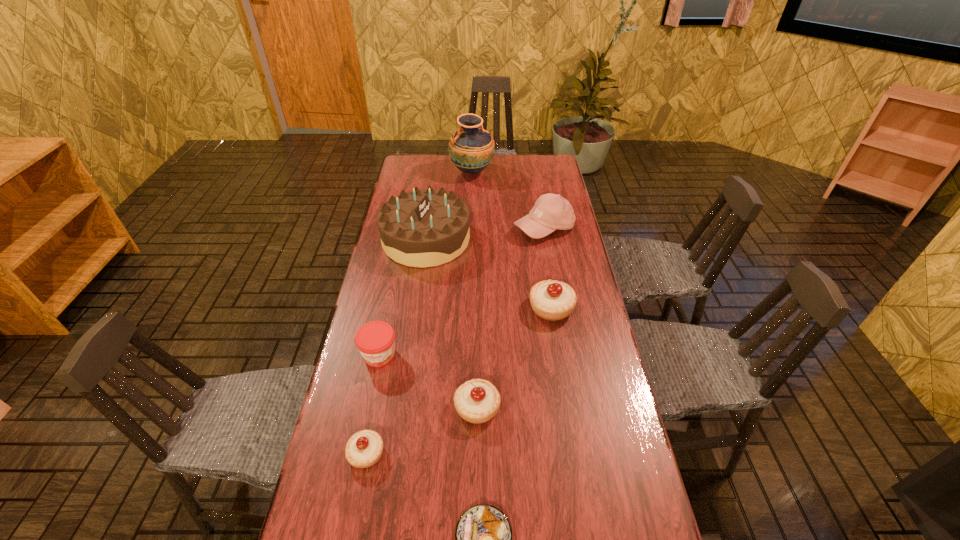
At what (x,y) coordinates should I click in order to perform the action: click on the tallest object. Please return your answer as a coordinate pair (x, y). Looking at the image, I should click on (471, 148).

Where is `the farthest object`? The height and width of the screenshot is (540, 960). the farthest object is located at coordinates (471, 148).

The height and width of the screenshot is (540, 960). In order to click on birthday cake in this screenshot , I will do `click(422, 228)`.

This screenshot has height=540, width=960. What are the coordinates of `brown birthday cake` in the screenshot? It's located at (422, 228).

Locate an element on the screen. baseball cap is located at coordinates (551, 211).

Image resolution: width=960 pixels, height=540 pixels. I want to click on the third tallest object, so click(551, 211).

You are a GUI agent. You are given a task and a screenshot of the screen. Output one action in this format:
    pyautogui.click(x=<x>, y=<y>)
    Task: Click on the rightmost pastry
    
    Given the screenshot: What is the action you would take?
    pyautogui.click(x=552, y=300)

You are a GUI agent. You are given a task and a screenshot of the screen. Output one action in this format:
    pyautogui.click(x=<x>, y=<y>)
    Task: Click on the tallest pastry
    
    Given the screenshot: What is the action you would take?
    pyautogui.click(x=552, y=300)

Locate an element on the screen. The height and width of the screenshot is (540, 960). jam is located at coordinates (375, 340).

The width and height of the screenshot is (960, 540). I want to click on red jam, so click(375, 340).